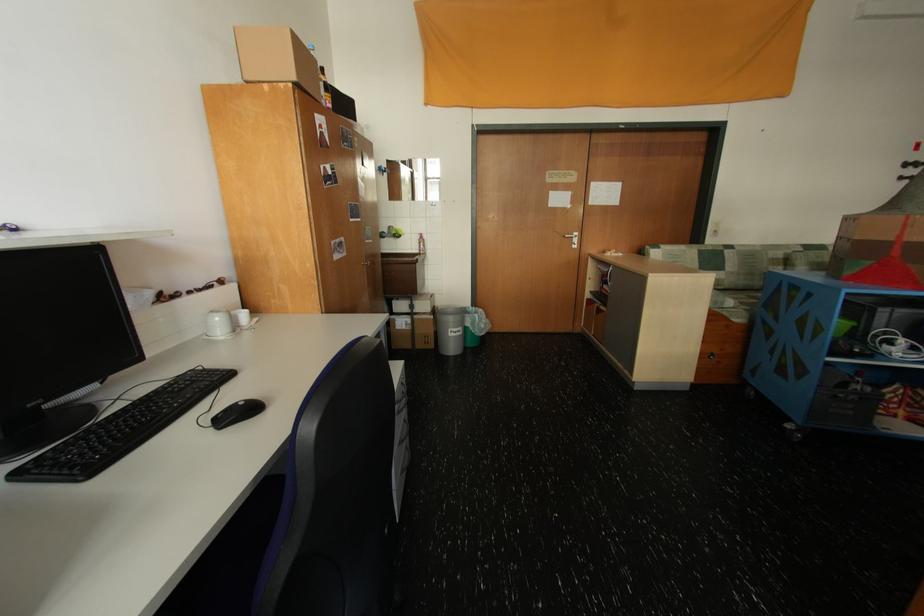
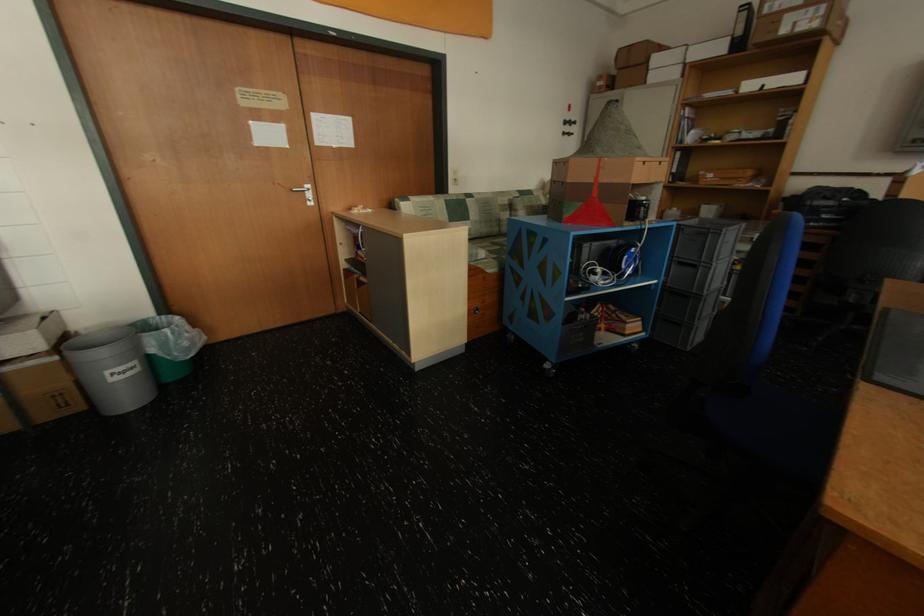
Find the pixel in the second image that matches pixel 468 330 in the first image.

(142, 363)